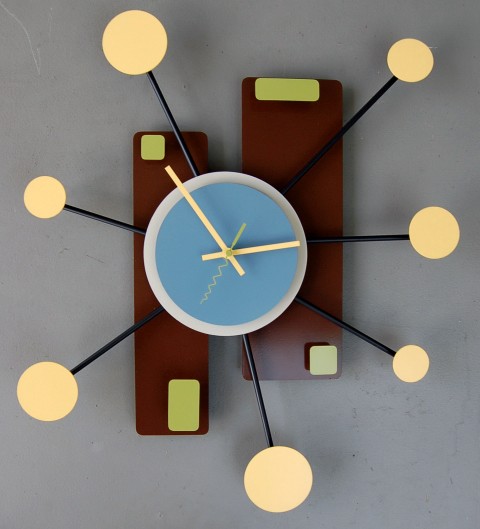
Locate an element on the screen. silver border of clock is located at coordinates (164, 211).